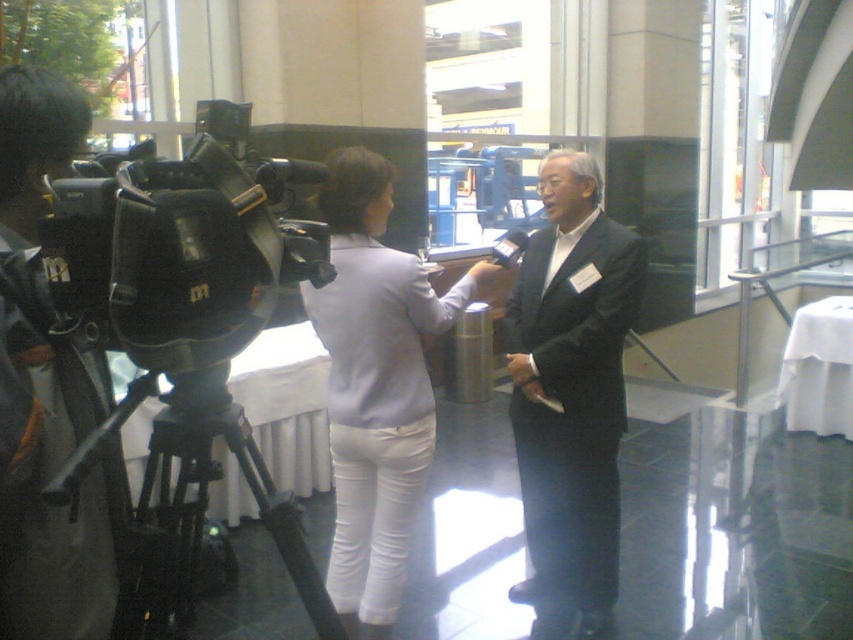
Question: Which object is the closest to the matte black suit at center?

Choices:
 (A) light purple fabric jacket at center
 (B) black plastic video camera at left
 (C) matte black camera at left

Answer: (A)

Question: Is the position of black plastic video camera at left less distant than that of matte black camera at left?

Choices:
 (A) yes
 (B) no

Answer: (A)

Question: Is black plastic video camera at left below light purple fabric jacket at center?

Choices:
 (A) yes
 (B) no

Answer: (B)

Question: Which of these objects is positioned farthest from the light purple fabric jacket at center?

Choices:
 (A) black matte tripod at lower left
 (B) matte black suit at center
 (C) matte black camera at left

Answer: (C)

Question: In this image, where is light purple fabric jacket at center located relative to black matte tripod at lower left?

Choices:
 (A) right
 (B) left

Answer: (A)

Question: Which point is closer to the camera?

Choices:
 (A) matte black camera at left
 (B) black plastic video camera at left
 (C) light purple fabric jacket at center
 (D) matte black suit at center

Answer: (B)